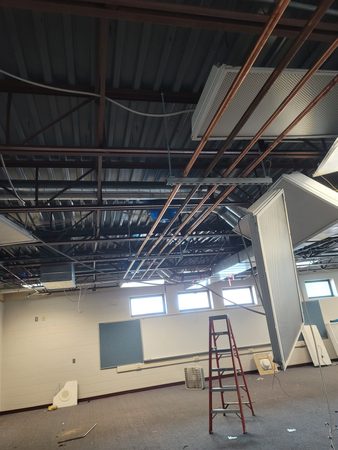
Find the location of `floor`. floor is located at coordinates (23, 425).